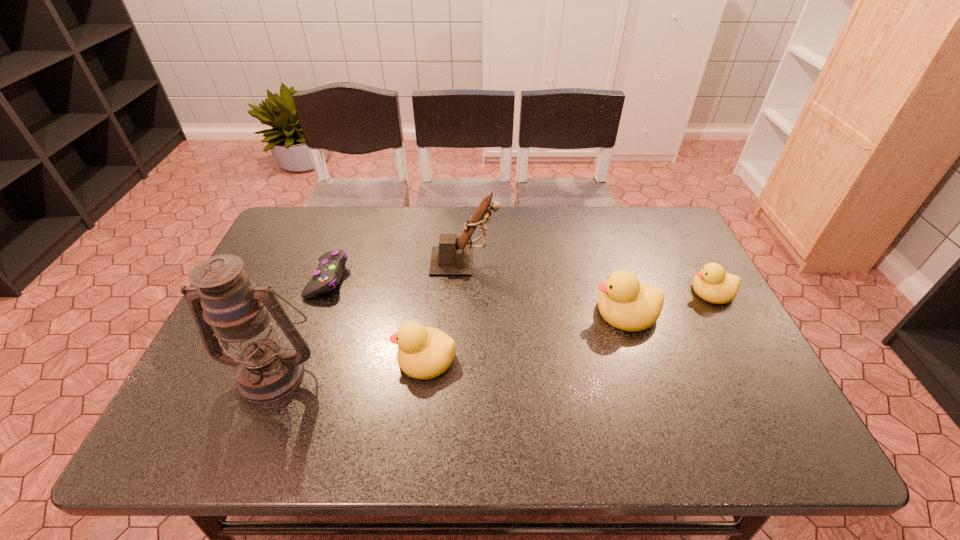
Find the location of `vacant space that's between the second object from right to left and the rightmost object`. vacant space that's between the second object from right to left and the rightmost object is located at coordinates (668, 301).

Locate an element on the screen. Image resolution: width=960 pixels, height=540 pixels. free spot between the second shortest duckling and the second object from right to left is located at coordinates (525, 335).

Image resolution: width=960 pixels, height=540 pixels. I want to click on free point between the fifth tallest object and the figurine, so click(x=588, y=276).

You are a GUI agent. You are given a task and a screenshot of the screen. Output one action in this format:
    pyautogui.click(x=<x>, y=<y>)
    Task: Click on the closest object to the control
    Image resolution: width=960 pixels, height=540 pixels.
    Given the screenshot: What is the action you would take?
    pyautogui.click(x=267, y=369)

Select which object is the third closest to the fourth tallest object. Please provide its 2D coordinates. Your answer should be formatted as a tuple, i.e. [(x, y)], where the tuple contains the x and y coordinates of a point satisfying the conditions above.

[(452, 257)]

Locate which duckling is the third closest to the figurine. Please provide its 2D coordinates. Your answer should be formatted as a tuple, i.e. [(x, y)], where the tuple contains the x and y coordinates of a point satisfying the conditions above.

[(712, 284)]

Locate which duckling ranks second in proximity to the second duckling from left to right. Please provide its 2D coordinates. Your answer should be formatted as a tuple, i.e. [(x, y)], where the tuple contains the x and y coordinates of a point satisfying the conditions above.

[(423, 353)]

Find the location of `vacant space that satisfies the following two spatial constraints: 1. on the back side of the control; 2. on the right side of the tallest object`. vacant space that satisfies the following two spatial constraints: 1. on the back side of the control; 2. on the right side of the tallest object is located at coordinates (312, 279).